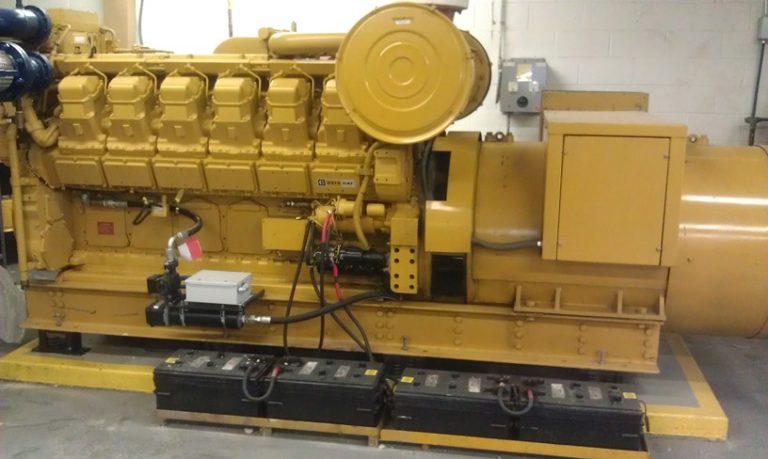
Image resolution: width=768 pixels, height=459 pixels. I want to click on grey floor, so click(111, 430).